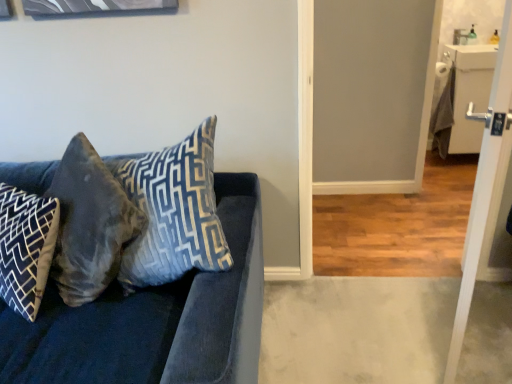
Question: In terms of size, does velvet blue pillow at center, the 1th pillow viewed from the right, appear bigger or smaller than velvet gray pillow at left, the second pillow from the right?

Choices:
 (A) big
 (B) small

Answer: (B)

Question: Considering their positions, is velvet blue pillow at center, the 3th pillow in the left-to-right sequence, located in front of or behind velvet gray pillow at left, the second pillow from the right?

Choices:
 (A) front
 (B) behind

Answer: (A)

Question: Which of these objects is positioned farthest from the velvet blue couch at left?

Choices:
 (A) white glossy door at right
 (B) blue-patterned fabric pillow at left, which is the 1th pillow in left-to-right order
 (C) velvet gray pillow at left, the second pillow from the right
 (D) velvet blue pillow at center, the 1th pillow viewed from the right

Answer: (A)

Question: Estimate the real-world distances between objects in this image. Which object is closer to the blue-patterned fabric pillow at left, which is the third pillow from right to left?

Choices:
 (A) velvet gray pillow at left, the second pillow from the right
 (B) white glossy door at right
 (C) velvet blue pillow at center, the 1th pillow viewed from the right
 (D) velvet blue couch at left

Answer: (A)